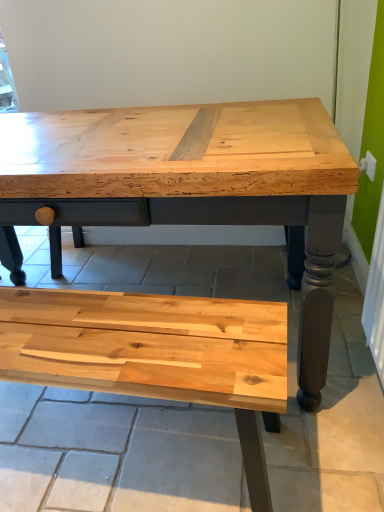
What do you see at coordinates (156, 354) in the screenshot? The image size is (384, 512). I see `natural wood bench at lower center` at bounding box center [156, 354].

The height and width of the screenshot is (512, 384). I want to click on natural wood bench at lower center, so click(x=156, y=354).

Measure the distance between natural wood bench at lower center and camera.

The depth of natural wood bench at lower center is 30.32 inches.

Locate an element on the screen. natural wood bench at lower center is located at coordinates point(156,354).